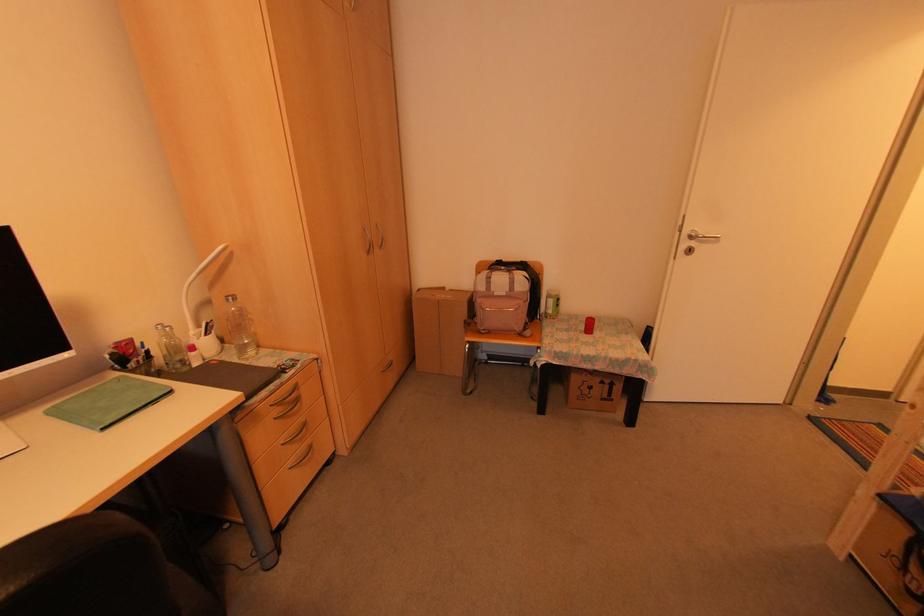
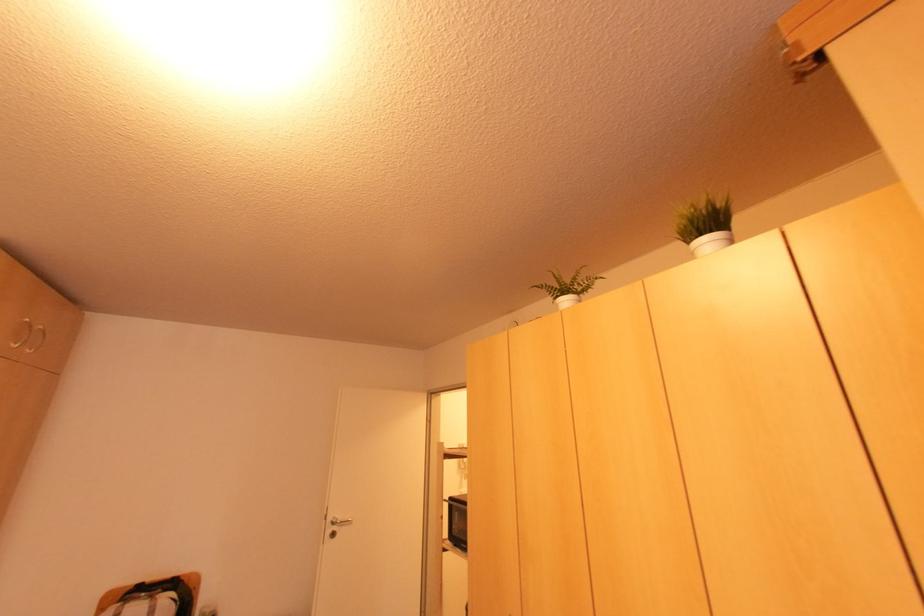
The first image is from the beginning of the video and the second image is from the end. How did the camera likely rotate when shooting the video?

The rotation direction of the camera is right-up.